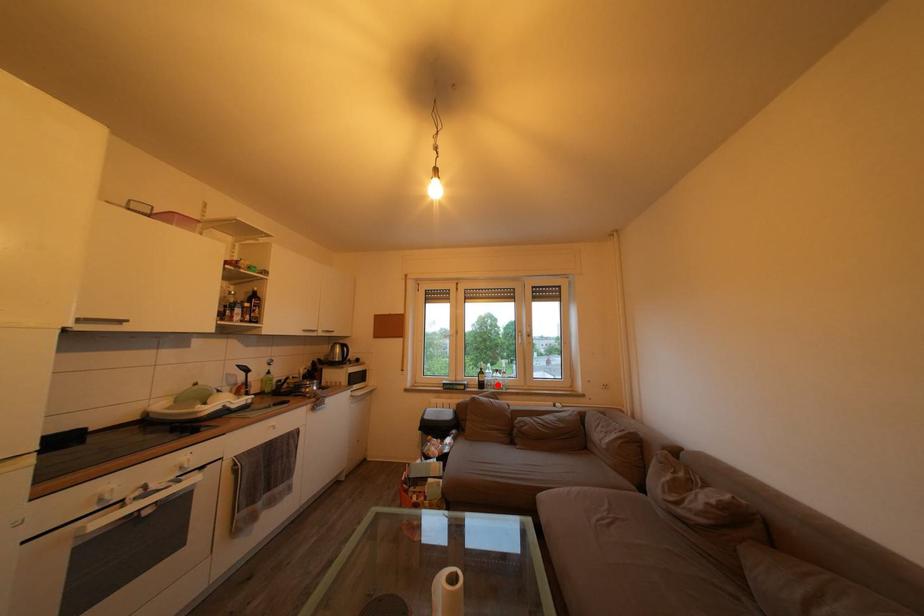
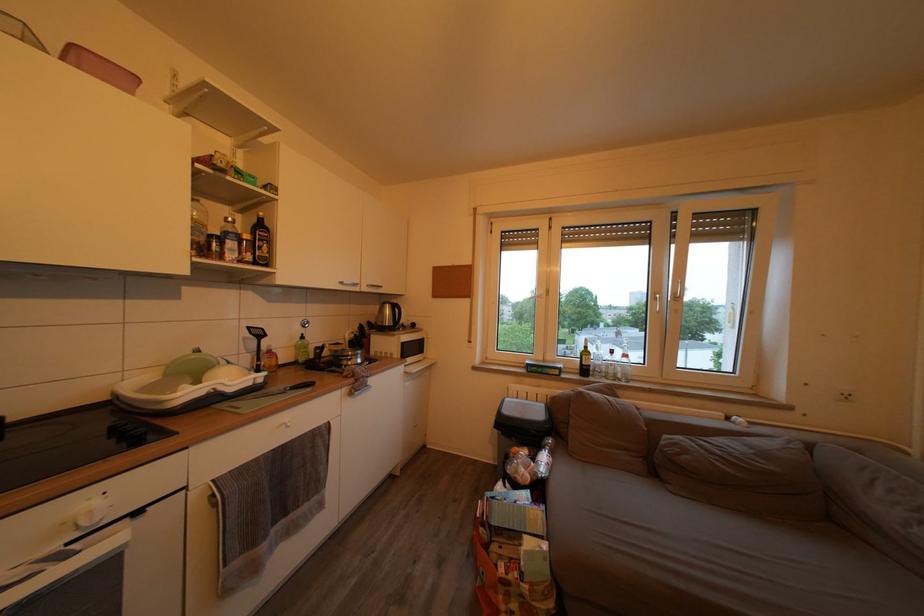
Question: I am providing you with two images of the same scene from different viewpoints. In image1, a red point is highlighted. Considering the same 3D point in image2, which of the following is correct?

Choices:
 (A) It is closer
 (B) It is farther

Answer: (A)